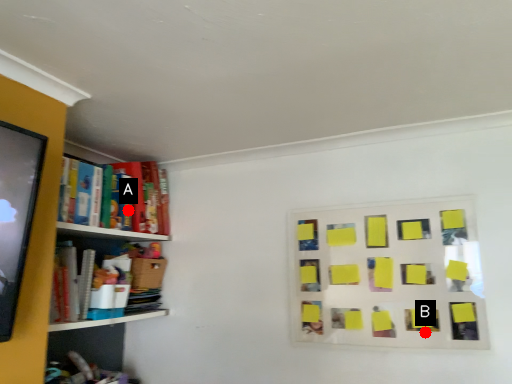
Question: Two points are circled on the image, labeled by A and B beside each circle. Among these points, which one is nearest to the camera?

Choices:
 (A) A is closer
 (B) B is closer

Answer: (B)